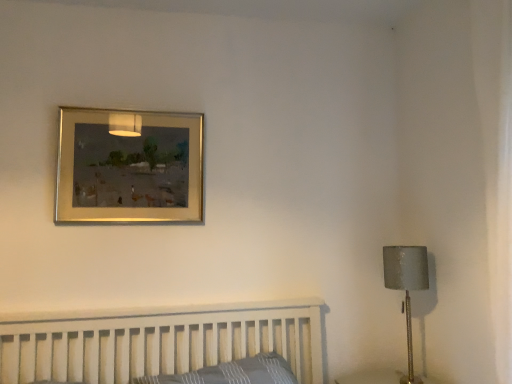
This screenshot has height=384, width=512. Describe the element at coordinates (406, 287) in the screenshot. I see `matte gray lampshade at right` at that location.

Find the location of a particular element. This screenshot has height=384, width=512. matte gray lampshade at right is located at coordinates (406, 287).

Can you confirm if gold metallic picture frame at upper center is bigger than matte gray lampshade at right?

No, gold metallic picture frame at upper center is not bigger than matte gray lampshade at right.

You are a GUI agent. You are given a task and a screenshot of the screen. Output one action in this format:
    pyautogui.click(x=<x>, y=<y>)
    Task: Click on the picture frame located behind the matte gray lampshade at right
    The image size is (512, 384).
    Given the screenshot: What is the action you would take?
    pyautogui.click(x=129, y=167)

Is gold metallic picture frame at upper center looking in the opposite direction of matte gray lampshade at right?

gold metallic picture frame at upper center is not turned away from matte gray lampshade at right.

Find the location of a particular element. This screenshot has height=384, width=512. table lamp lying on the right of gray plaid pillow at lower center is located at coordinates (406, 287).

Would you say gray plaid pillow at lower center is outside matte gray lampshade at right?

Indeed, gray plaid pillow at lower center is completely outside matte gray lampshade at right.

Is point (283, 378) closer or farther from the camera than point (393, 267)?

Point (283, 378) appears to be farther away from the viewer than point (393, 267).

In the scene shown: Is matte gray lampshade at right far from gray plaid pillow at lower center?

matte gray lampshade at right is actually quite close to gray plaid pillow at lower center.

Which object is thinner, matte gray lampshade at right or gray plaid pillow at lower center?

matte gray lampshade at right.

Between matte gray lampshade at right and gray plaid pillow at lower center, which one appears on the right side from the viewer's perspective?

matte gray lampshade at right is more to the right.

Is matte gray lampshade at right turned away from gray plaid pillow at lower center?

No, matte gray lampshade at right is not facing the opposite direction of gray plaid pillow at lower center.

Considering the positions of objects matte gray lampshade at right and gold metallic picture frame at upper center in the image provided, who is behind, matte gray lampshade at right or gold metallic picture frame at upper center?

Positioned behind is gold metallic picture frame at upper center.

Looking at their sizes, would you say matte gray lampshade at right is wider or thinner than gold metallic picture frame at upper center?

In the image, matte gray lampshade at right appears to be wider than gold metallic picture frame at upper center.

Does matte gray lampshade at right appear on the left side of gold metallic picture frame at upper center?

In fact, matte gray lampshade at right is to the right of gold metallic picture frame at upper center.

Does point (231, 382) lie in front of point (195, 146)?

That is True.

Is gray plaid pillow at lower center turned away from gold metallic picture frame at upper center?

No, gray plaid pillow at lower center is not facing the opposite direction of gold metallic picture frame at upper center.

Between gray plaid pillow at lower center and gold metallic picture frame at upper center, which one has more height?

gold metallic picture frame at upper center.

Is gray plaid pillow at lower center not close to gold metallic picture frame at upper center?

No, gray plaid pillow at lower center is not far from gold metallic picture frame at upper center.

How many degrees apart are the facing directions of gold metallic picture frame at upper center and gray plaid pillow at lower center?

3.32 degrees.

Considering the sizes of objects gold metallic picture frame at upper center and gray plaid pillow at lower center in the image provided, who is thinner, gold metallic picture frame at upper center or gray plaid pillow at lower center?

With smaller width is gold metallic picture frame at upper center.

From the image's perspective, is gold metallic picture frame at upper center above gray plaid pillow at lower center?

Yes, from the image's perspective, gold metallic picture frame at upper center is on top of gray plaid pillow at lower center.

Does gold metallic picture frame at upper center lie behind gray plaid pillow at lower center?

Yes, the depth of gold metallic picture frame at upper center is greater than that of gray plaid pillow at lower center.

The height and width of the screenshot is (384, 512). Identify the location of table lamp on the right of gold metallic picture frame at upper center. (406, 287).

Identify the location of pillow that appears in front of the matte gray lampshade at right. (233, 373).

When comparing their distances from gold metallic picture frame at upper center, does matte gray lampshade at right or gray plaid pillow at lower center seem further?

matte gray lampshade at right.

When comparing their distances from matte gray lampshade at right, does gold metallic picture frame at upper center or gray plaid pillow at lower center seem closer?

gray plaid pillow at lower center lies closer to matte gray lampshade at right than the other object.

From the image, which object appears to be farther from gold metallic picture frame at upper center, gray plaid pillow at lower center or matte gray lampshade at right?

matte gray lampshade at right.

Considering their positions, is gray plaid pillow at lower center positioned closer to matte gray lampshade at right than gold metallic picture frame at upper center?

Based on the image, gray plaid pillow at lower center appears to be nearer to matte gray lampshade at right.

Estimate the real-world distances between objects in this image. Which object is closer to gray plaid pillow at lower center, matte gray lampshade at right or gold metallic picture frame at upper center?

matte gray lampshade at right is positioned closer to the anchor gray plaid pillow at lower center.

Estimate the real-world distances between objects in this image. Which object is further from gray plaid pillow at lower center, gold metallic picture frame at upper center or matte gray lampshade at right?

gold metallic picture frame at upper center is further to gray plaid pillow at lower center.

Locate an element on the screen. pillow between gold metallic picture frame at upper center and matte gray lampshade at right in the horizontal direction is located at coordinates (233, 373).